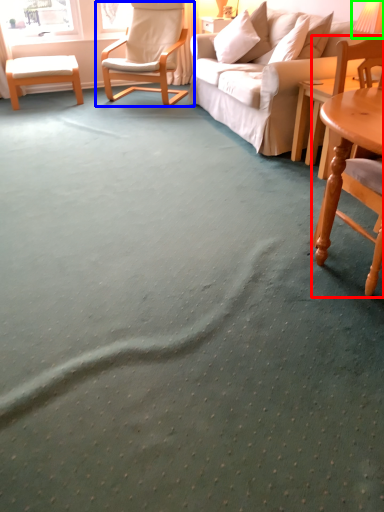
Question: Which object is positioned farthest from chair (highlighted by a red box)? Select from chair (highlighted by a blue box) and table lamp (highlighted by a green box).

Choices:
 (A) chair
 (B) table lamp

Answer: (A)